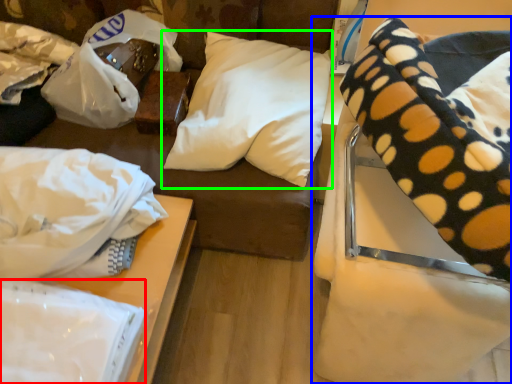
Question: Which object is positioned farthest from linen (highlighted by a red box)? Select from furniture (highlighted by a blue box) and pillow (highlighted by a green box).

Choices:
 (A) furniture
 (B) pillow

Answer: (B)